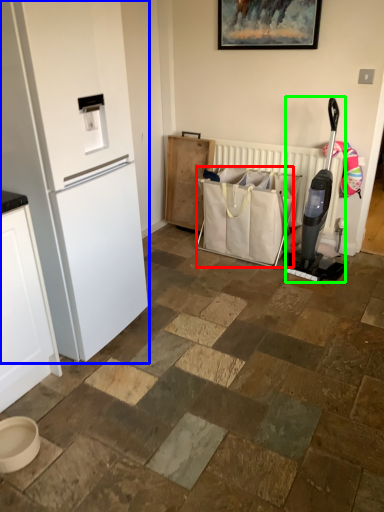
Question: Considering the real-world distances, which object is farthest from shopping bag (highlighted by a red box)? refrigerator (highlighted by a blue box) or appliance (highlighted by a green box)?

Choices:
 (A) refrigerator
 (B) appliance

Answer: (A)